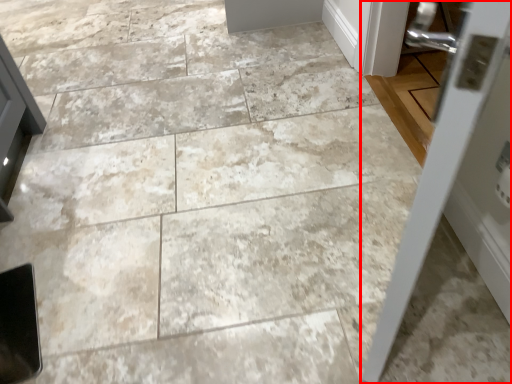
Question: Considering the relative positions of door (annotated by the red box) and door in the image provided, where is door (annotated by the red box) located with respect to the staircase?

Choices:
 (A) left
 (B) right

Answer: (A)